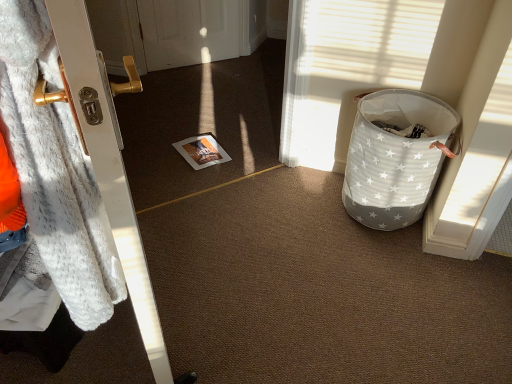
Question: Is the depth of white star-patterned fabric basket at right greater than that of white fur coat at left?

Choices:
 (A) yes
 (B) no

Answer: (A)

Question: Is there a large distance between white star-patterned fabric basket at right and white fur coat at left?

Choices:
 (A) no
 (B) yes

Answer: (B)

Question: From the image's perspective, does white star-patterned fabric basket at right appear lower than white fur coat at left?

Choices:
 (A) yes
 (B) no

Answer: (B)

Question: Does white star-patterned fabric basket at right appear on the left side of white fur coat at left?

Choices:
 (A) no
 (B) yes

Answer: (A)

Question: Considering the relative sizes of white star-patterned fabric basket at right and white fur coat at left in the image provided, is white star-patterned fabric basket at right wider than white fur coat at left?

Choices:
 (A) yes
 (B) no

Answer: (A)

Question: Would you say white fur coat at left is to the left or to the right of white star-patterned fabric basket at right in the picture?

Choices:
 (A) right
 (B) left

Answer: (B)

Question: Based on their sizes in the image, would you say white fur coat at left is bigger or smaller than white star-patterned fabric basket at right?

Choices:
 (A) big
 (B) small

Answer: (A)

Question: From a real-world perspective, is white fur coat at left above or below white star-patterned fabric basket at right?

Choices:
 (A) above
 (B) below

Answer: (A)

Question: In the image, is white fur coat at left positioned in front of or behind white star-patterned fabric basket at right?

Choices:
 (A) front
 (B) behind

Answer: (A)

Question: Is fuzzy white blanket at left spatially inside white fur coat at left, or outside of it?

Choices:
 (A) outside
 (B) inside

Answer: (A)

Question: Considering the positions of fuzzy white blanket at left and white fur coat at left in the image, is fuzzy white blanket at left bigger or smaller than white fur coat at left?

Choices:
 (A) small
 (B) big

Answer: (A)

Question: From a real-world perspective, relative to white fur coat at left, is fuzzy white blanket at left vertically above or below?

Choices:
 (A) below
 (B) above

Answer: (B)

Question: From their relative heights in the image, would you say fuzzy white blanket at left is taller or shorter than white fur coat at left?

Choices:
 (A) short
 (B) tall

Answer: (A)

Question: From the image's perspective, relative to fuzzy white blanket at left, is white star-patterned fabric basket at right above or below?

Choices:
 (A) above
 (B) below

Answer: (A)

Question: Relative to fuzzy white blanket at left, is white star-patterned fabric basket at right in front or behind?

Choices:
 (A) front
 (B) behind

Answer: (B)